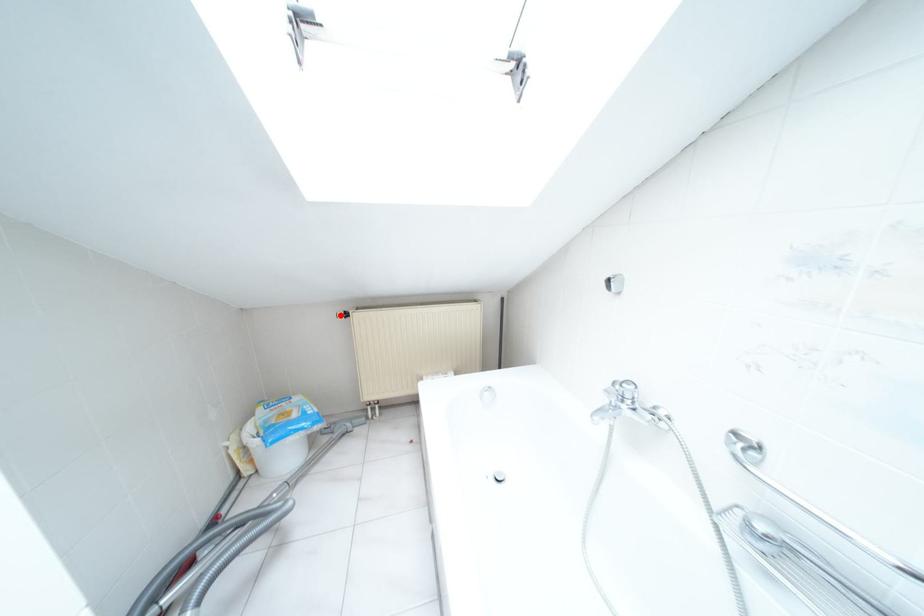
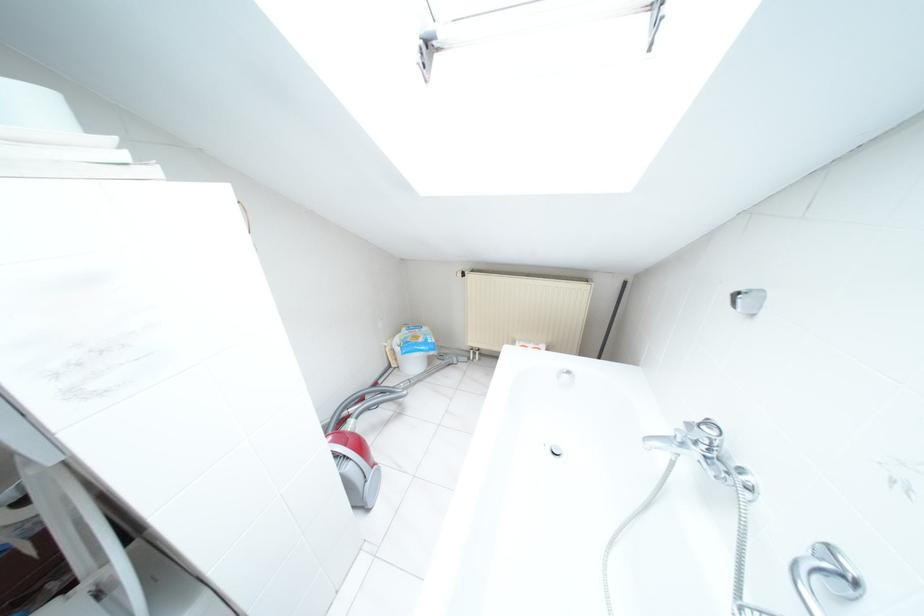
Question: I am providing you with two images of the same scene from different viewpoints. Given a red point in image1, look at the same physical point in image2. Is it:

Choices:
 (A) Closer to the viewpoint
 (B) Farther from the viewpoint

Answer: (A)